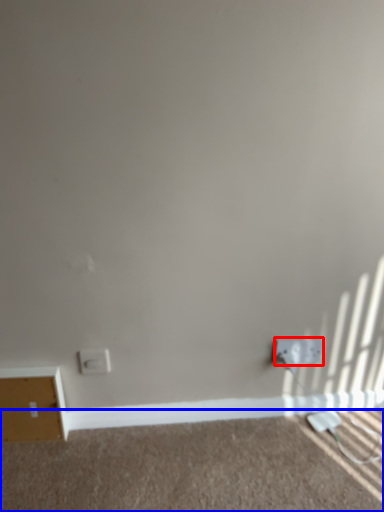
Question: Which point is further to the camera, power plugs and sockets (highlighted by a red box) or plain (highlighted by a blue box)?

Choices:
 (A) power plugs and sockets
 (B) plain

Answer: (A)